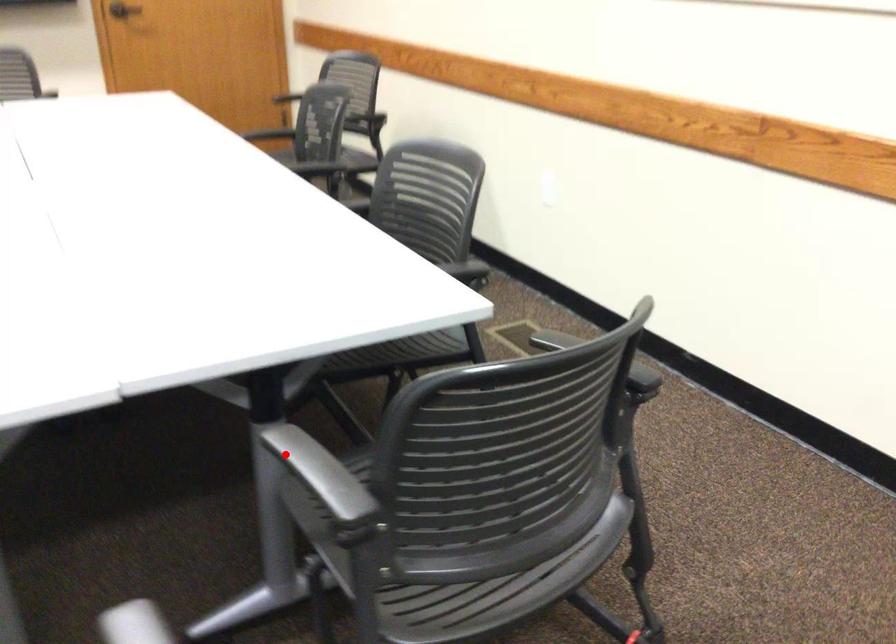
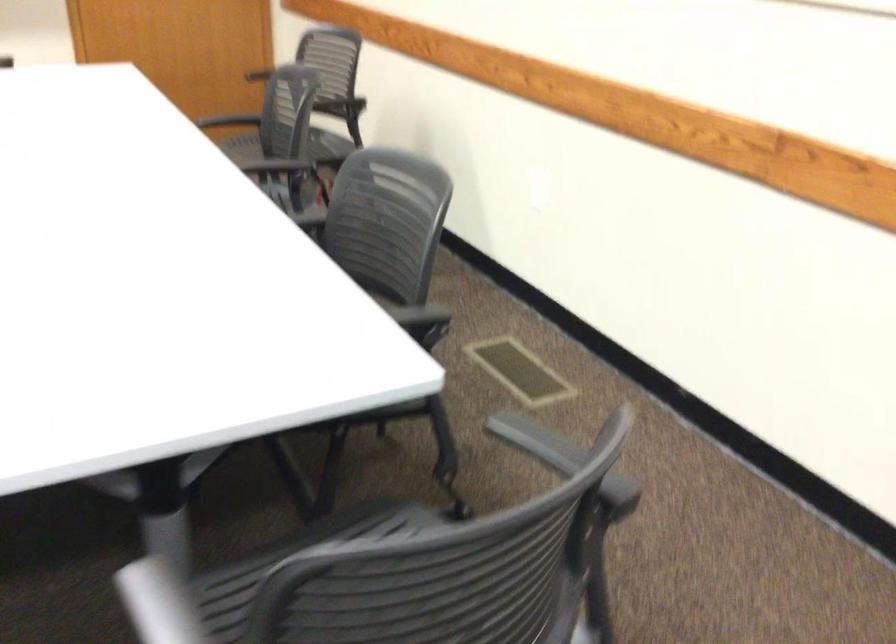
Question: I am providing you with two images of the same scene from different viewpoints. In image1, a red point is highlighted. Considering the same 3D point in image2, which of the following is correct?

Choices:
 (A) It is closer
 (B) It is farther

Answer: (A)